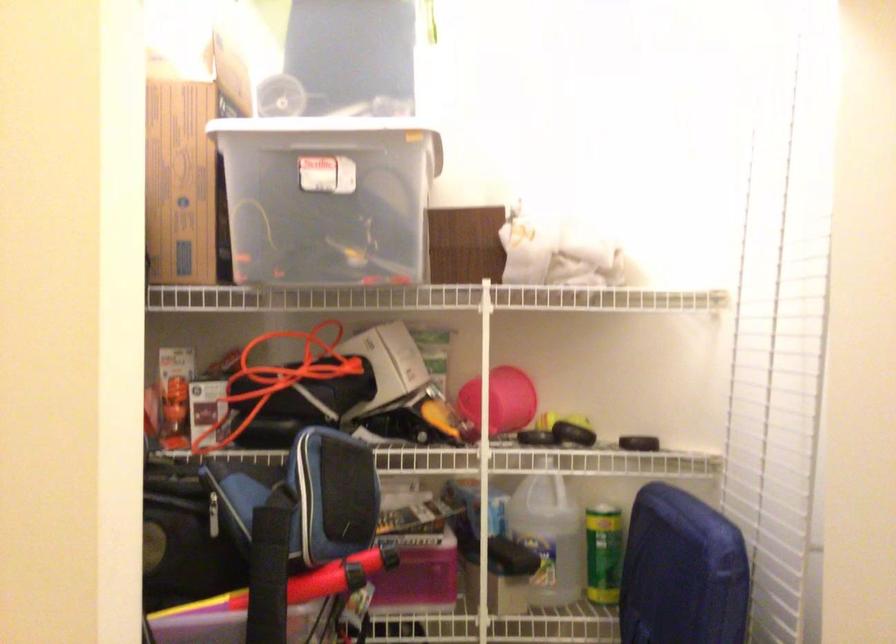
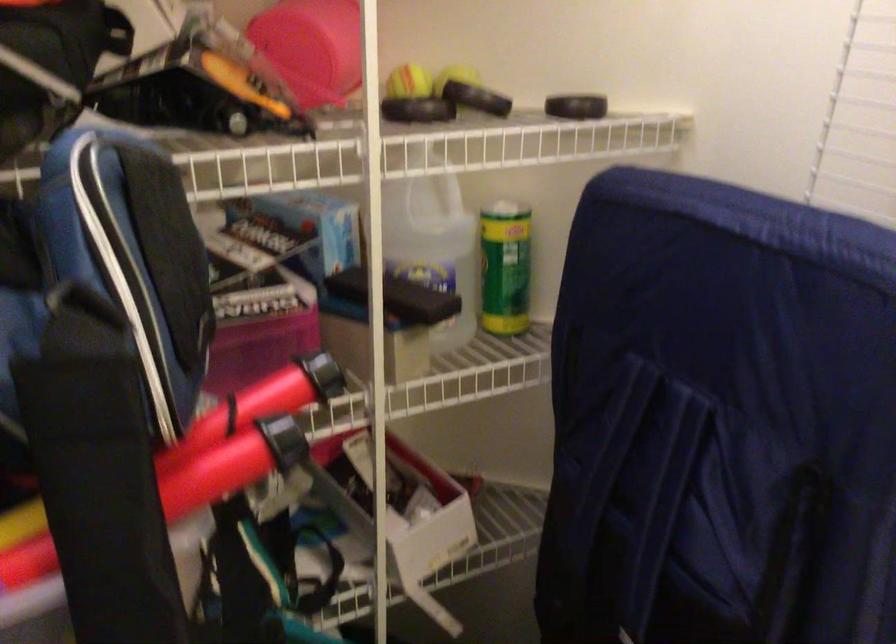
Where in the second image is the point corresponding to point 543,424 from the first image?

(409, 82)